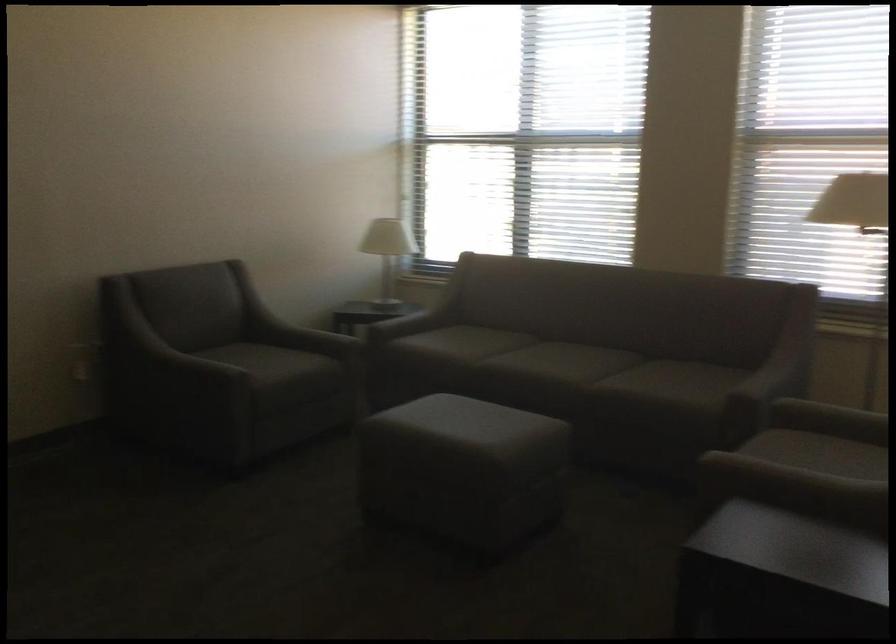
This screenshot has height=644, width=896. Identify the location of chair sitting surface. (259, 359).